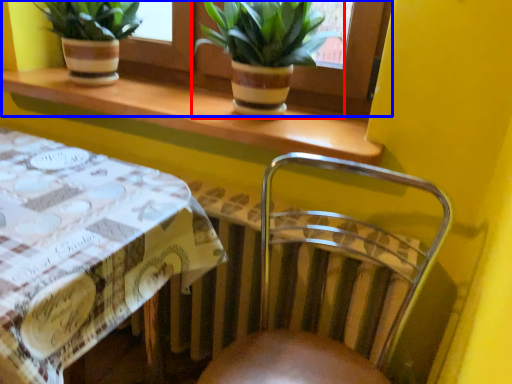
Question: Which of the following is the farthest to the observer, houseplant (highlighted by a red box) or window frame (highlighted by a blue box)?

Choices:
 (A) houseplant
 (B) window frame

Answer: (B)